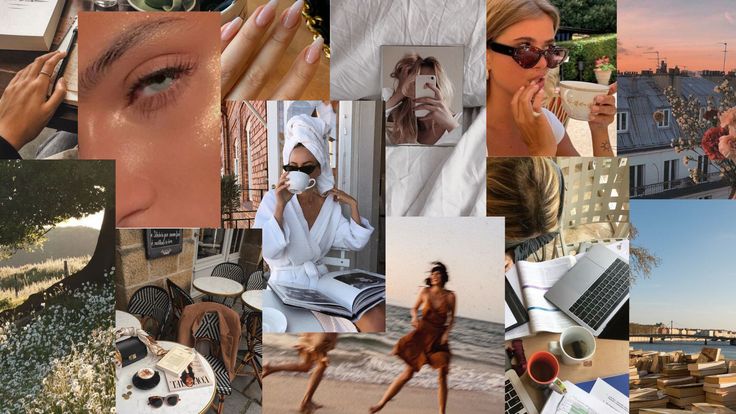
Find the location of `mug`. mug is located at coordinates (573, 96), (570, 347), (542, 370), (297, 180), (141, 376).